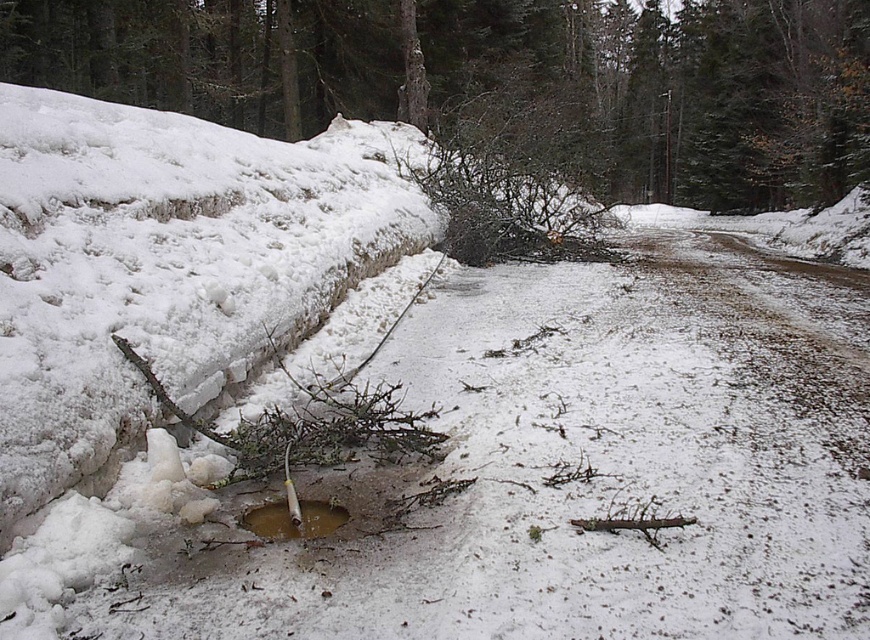
Does smooth snow-covered tree trunk at center have a larger size compared to brown matte puddle at center?

Yes.

Who is shorter, smooth snow-covered tree trunk at center or brown matte puddle at center?

brown matte puddle at center

Between point (298, 13) and point (318, 532), which one is positioned behind?

The point (298, 13) is more distant.

Locate an element on the screen. This screenshot has height=640, width=870. smooth snow-covered tree trunk at center is located at coordinates (670, 90).